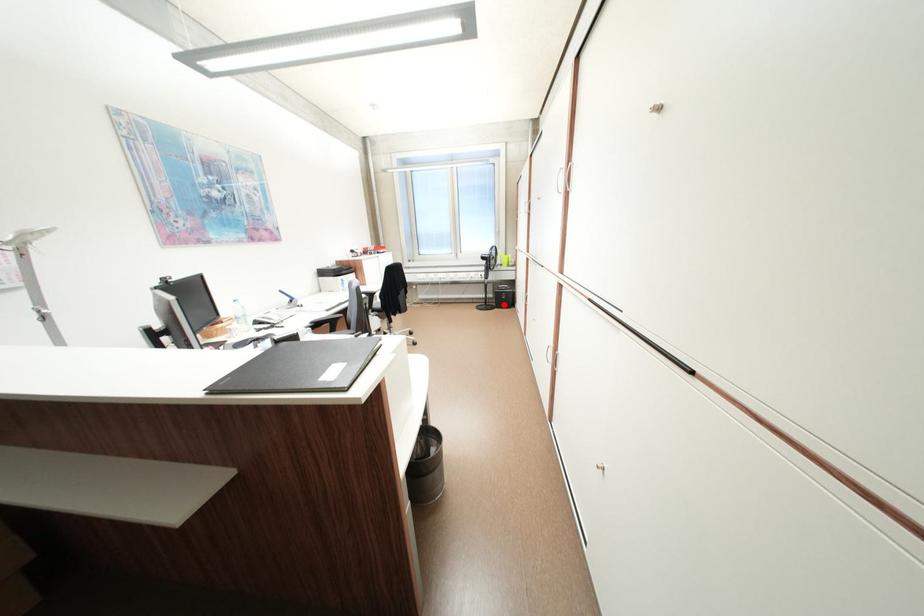
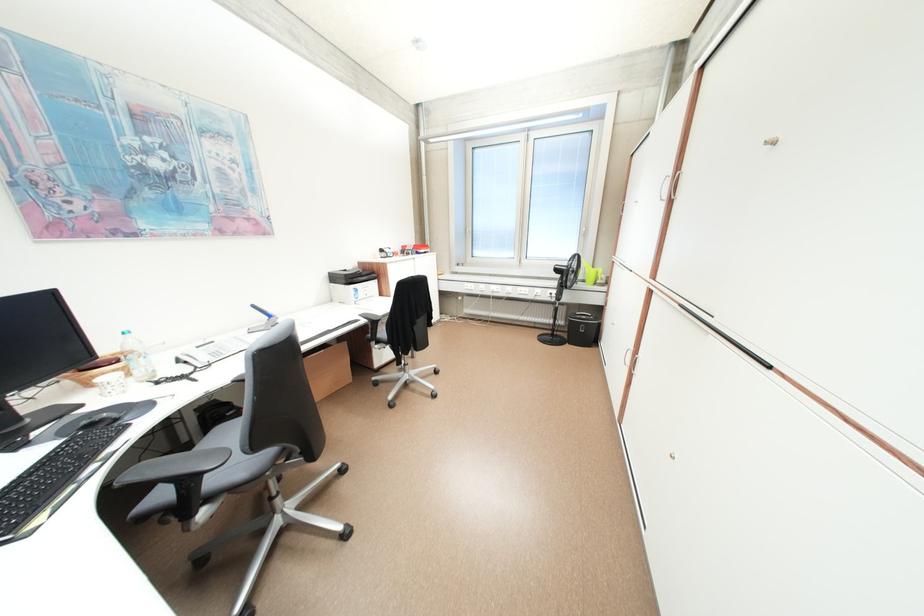
Locate, in the second image, the point that corresponds to the highlighted location in the first image.

(576, 337)